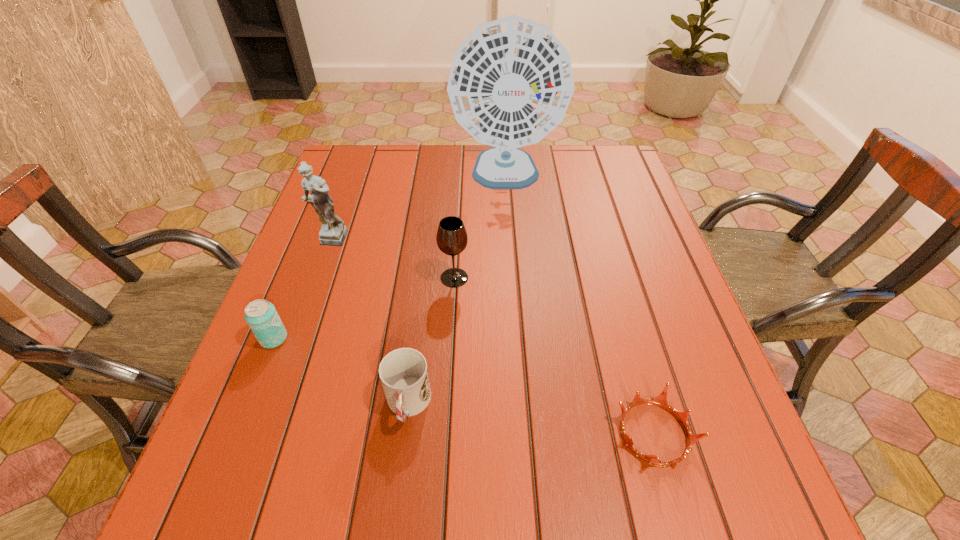
Where is `vacant space at the near edge of the desktop`? vacant space at the near edge of the desktop is located at coordinates (611, 512).

What are the coordinates of `free region at the left edge` in the screenshot? It's located at (308, 251).

Find the location of a particular element. Image resolution: width=960 pixels, height=540 pixels. vacant space at the right edge of the desktop is located at coordinates (657, 267).

Where is `free point at the far left corner`? free point at the far left corner is located at coordinates (363, 149).

The height and width of the screenshot is (540, 960). Identify the location of vacant space at the near right corner of the desktop. (755, 492).

Identify the location of free space between the fan and the third farthest object. (480, 227).

What are the coordinates of `free area in between the crown and the wineglass` in the screenshot? It's located at (554, 355).

Locate an element on the screen. unoccupied position between the fan and the cup is located at coordinates (457, 291).

This screenshot has width=960, height=540. I want to click on vacant space that is in between the fourth shortest object and the second farthest object, so click(392, 259).

Identify the location of vacant area that lies between the third nearest object and the cup. (341, 372).